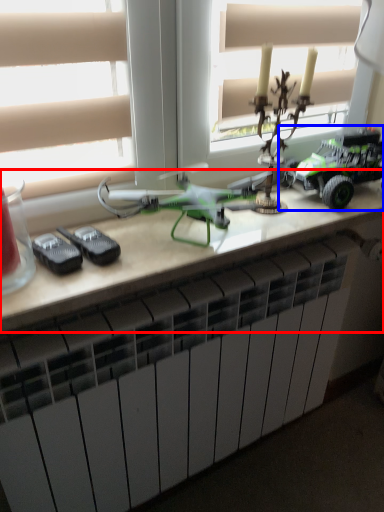
Question: Which point is further to the camera, table (highlighted by a red box) or toy (highlighted by a blue box)?

Choices:
 (A) table
 (B) toy

Answer: (B)